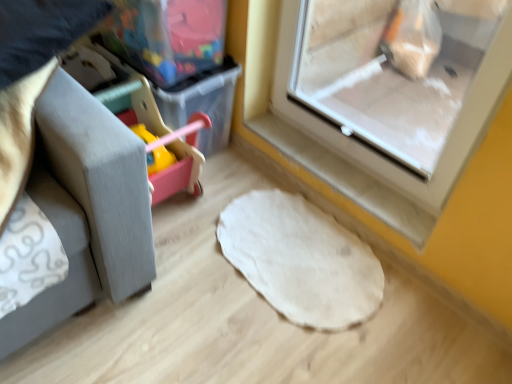
What is the approximate height of white felt mat at center?

The height of white felt mat at center is 1.22 inches.

The width and height of the screenshot is (512, 384). What do you see at coordinates (167, 36) in the screenshot?
I see `translucent plastic storage box at upper left` at bounding box center [167, 36].

I want to click on transparent plastic screen door at upper right, so click(x=389, y=74).

In the image, is transparent plastic screen door at upper right positioned in front of or behind translucent plastic storage box at upper left?

Clearly, transparent plastic screen door at upper right is in front of translucent plastic storage box at upper left.

Can you confirm if transparent plastic screen door at upper right is positioned to the right of translucent plastic storage box at upper left?

Yes.

Are transparent plastic screen door at upper right and translucent plastic storage box at upper left beside each other?

No, transparent plastic screen door at upper right is not making contact with translucent plastic storage box at upper left.

From the image's perspective, relative to white felt mat at center, is transparent plastic screen door at upper right above or below?

transparent plastic screen door at upper right is situated higher than white felt mat at center in the image.

From the picture: Is white felt mat at center at the back of transparent plastic screen door at upper right?

No, transparent plastic screen door at upper right's orientation is not away from white felt mat at center.

From a real-world perspective, is transparent plastic screen door at upper right physically above white felt mat at center?

Yes, from a real-world perspective, transparent plastic screen door at upper right is above white felt mat at center.

Does transparent plastic screen door at upper right have a smaller size compared to white felt mat at center?

No.

Locate an element on the screen. screen door located above the white felt mat at center (from the image's perspective) is located at coordinates (389, 74).

Considering the sizes of white felt mat at center and transparent plastic screen door at upper right in the image, is white felt mat at center taller or shorter than transparent plastic screen door at upper right?

In the image, white felt mat at center appears to be shorter than transparent plastic screen door at upper right.

From a real-world perspective, who is located higher, white felt mat at center or transparent plastic screen door at upper right?

transparent plastic screen door at upper right.

Considering the sizes of objects white felt mat at center and transparent plastic screen door at upper right in the image provided, who is wider, white felt mat at center or transparent plastic screen door at upper right?

With larger width is white felt mat at center.

Is translucent plastic storage box at upper left positioned behind white felt mat at center?

Yes, the depth of translucent plastic storage box at upper left is greater than that of white felt mat at center.

In the scene shown: How many degrees apart are the facing directions of translucent plastic storage box at upper left and white felt mat at center?

The angular difference between translucent plastic storage box at upper left and white felt mat at center is 90 degrees.

Is translucent plastic storage box at upper left looking in the opposite direction of white felt mat at center?

translucent plastic storage box at upper left does not have its back to white felt mat at center.

From the picture: Could you tell me if white felt mat at center is facing translucent plastic storage box at upper left?

No, white felt mat at center is not oriented towards translucent plastic storage box at upper left.

Does white felt mat at center lie in front of translucent plastic storage box at upper left?

Yes, white felt mat at center is closer to the viewer.

Where is `mat located underneath the translucent plastic storage box at upper left (from a real-world perspective)`? This screenshot has width=512, height=384. mat located underneath the translucent plastic storage box at upper left (from a real-world perspective) is located at coordinates (301, 259).

Choose the correct answer: Is translucent plastic storage box at upper left inside transparent plastic screen door at upper right or outside it?

translucent plastic storage box at upper left is outside transparent plastic screen door at upper right.

The image size is (512, 384). I want to click on storage box located above the transparent plastic screen door at upper right (from the image's perspective), so click(x=167, y=36).

Is translucent plastic storage box at upper left behind transparent plastic screen door at upper right?

Yes, translucent plastic storage box at upper left is further from the camera.

Which of these two, translucent plastic storage box at upper left or transparent plastic screen door at upper right, stands taller?

transparent plastic screen door at upper right is taller.

Where is `screen door below the translucent plastic storage box at upper left (from a real-world perspective)`? This screenshot has height=384, width=512. screen door below the translucent plastic storage box at upper left (from a real-world perspective) is located at coordinates (389, 74).

The width and height of the screenshot is (512, 384). I want to click on mat on the left of the transparent plastic screen door at upper right, so click(301, 259).

Considering their positions, is white felt mat at center positioned closer to transparent plastic screen door at upper right than translucent plastic storage box at upper left?

white felt mat at center lies closer to transparent plastic screen door at upper right than the other object.

From the image, which object appears to be farther from transparent plastic screen door at upper right, translucent plastic storage box at upper left or white felt mat at center?

translucent plastic storage box at upper left lies further to transparent plastic screen door at upper right than the other object.

Looking at the image, which one is located closer to translucent plastic storage box at upper left, white felt mat at center or transparent plastic screen door at upper right?

Among the two, white felt mat at center is located nearer to translucent plastic storage box at upper left.

From the image, which object appears to be nearer to translucent plastic storage box at upper left, transparent plastic screen door at upper right or white felt mat at center?

white felt mat at center is positioned closer to the anchor translucent plastic storage box at upper left.

Considering their positions, is translucent plastic storage box at upper left positioned further to white felt mat at center than transparent plastic screen door at upper right?

transparent plastic screen door at upper right is further to white felt mat at center.

Which object lies further to the anchor point white felt mat at center, transparent plastic screen door at upper right or translucent plastic storage box at upper left?

Among the two, transparent plastic screen door at upper right is located further to white felt mat at center.

The height and width of the screenshot is (384, 512). Identify the location of screen door between translucent plastic storage box at upper left and white felt mat at center from top to bottom. (389, 74).